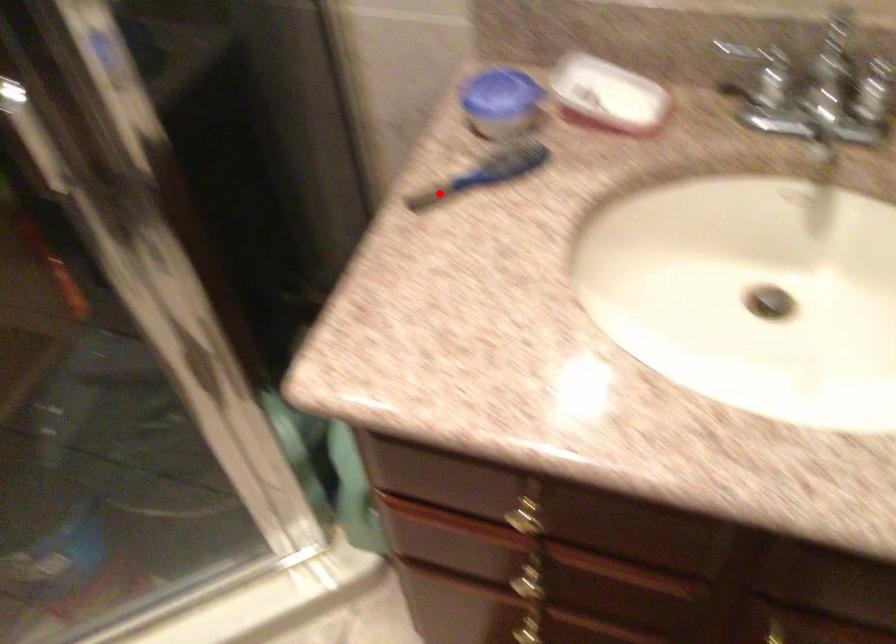
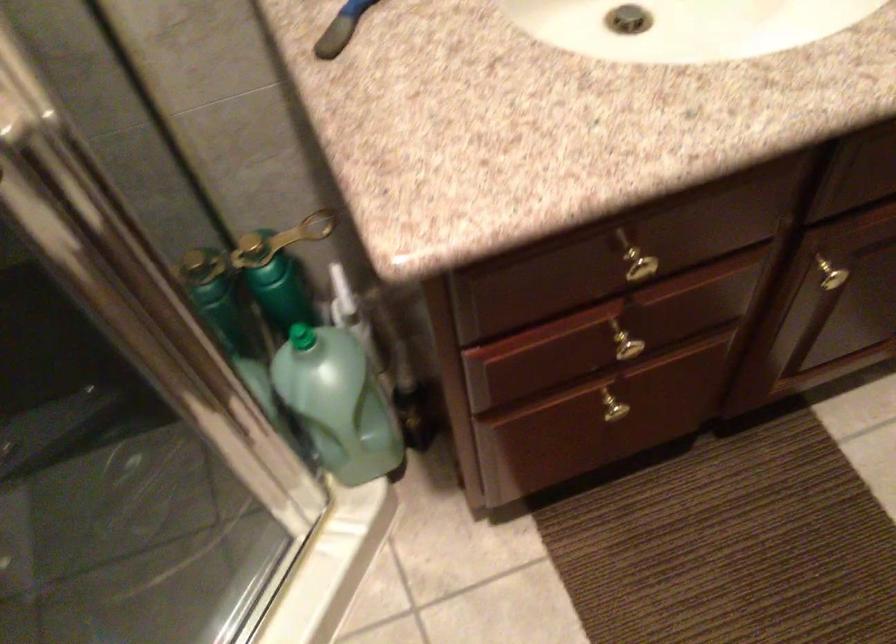
Find the pixel in the second image that matches the highlighted location in the first image.

(340, 29)